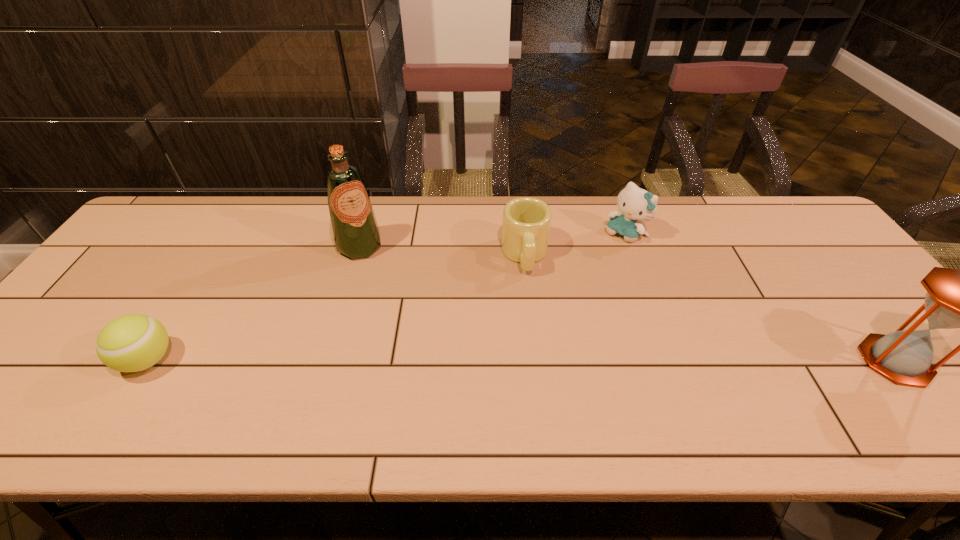
This screenshot has height=540, width=960. Identify the location of free space between the third object from left to right and the third shortest object. (576, 245).

Locate an element on the screen. The image size is (960, 540). object that is the closest one to the mug is located at coordinates (635, 204).

This screenshot has width=960, height=540. In order to click on object identified as the third closest to the mug in this screenshot , I will do `click(956, 298)`.

The height and width of the screenshot is (540, 960). What are the coordinates of `free location that satisfies the following two spatial constraints: 1. on the front side of the hourglass; 2. on the left side of the mug` in the screenshot? It's located at (537, 361).

Locate an element on the screen. vacant space that satisfies the following two spatial constraints: 1. on the back side of the leftmost object; 2. on the left side of the second object from left to right is located at coordinates (220, 247).

This screenshot has height=540, width=960. What are the coordinates of `free location that satisfies the following two spatial constraints: 1. on the front side of the olive oil; 2. on the left side of the hourglass` in the screenshot? It's located at (326, 361).

The width and height of the screenshot is (960, 540). Find the location of `free space that satisfies the following two spatial constraints: 1. on the front side of the hourglass; 2. on the left side of the third object from right to left`. free space that satisfies the following two spatial constraints: 1. on the front side of the hourglass; 2. on the left side of the third object from right to left is located at coordinates (537, 361).